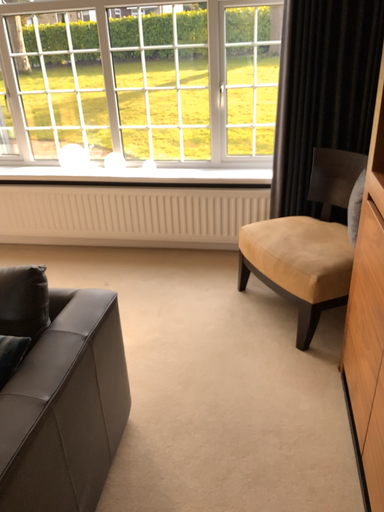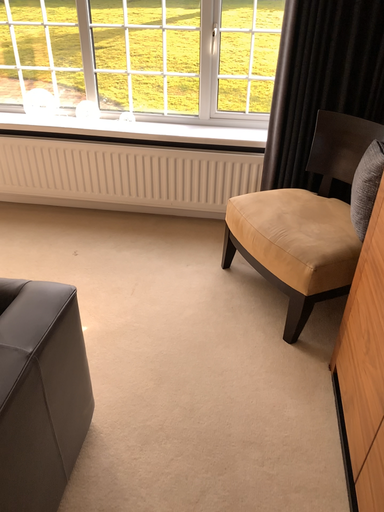
Question: How did the camera likely rotate when shooting the video?

Choices:
 (A) rotated downward
 (B) rotated upward

Answer: (A)